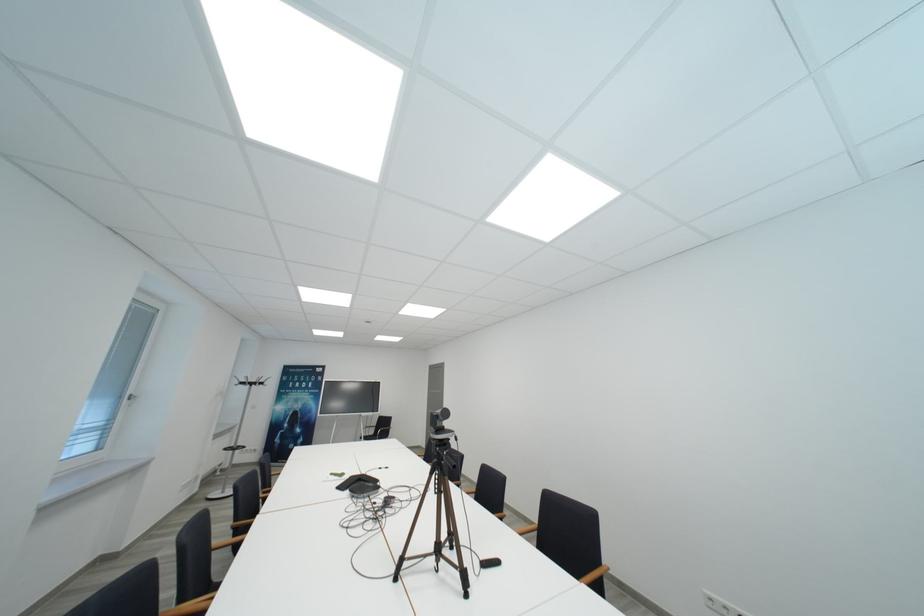
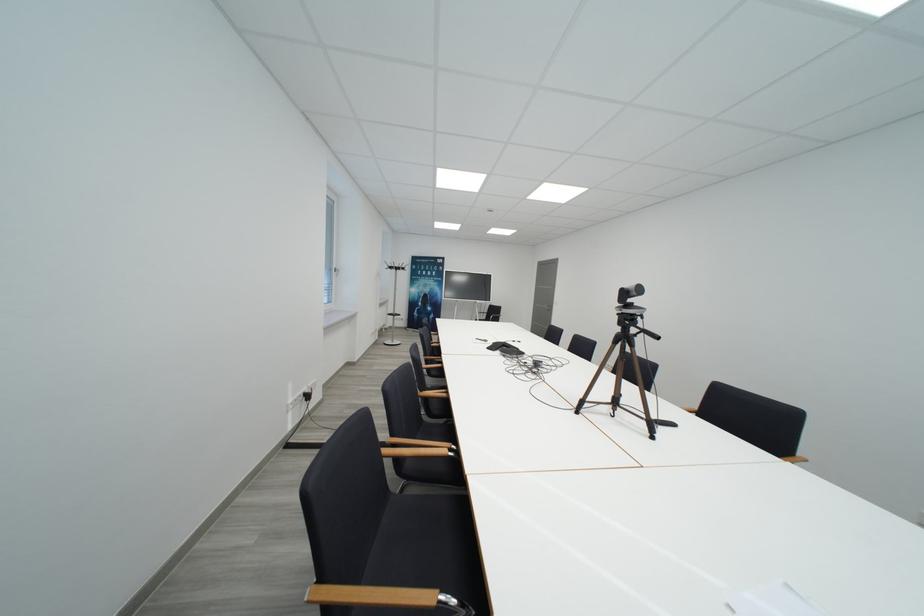
Locate, in the second image, the point that corresponds to (x=349, y=477) in the first image.

(492, 344)